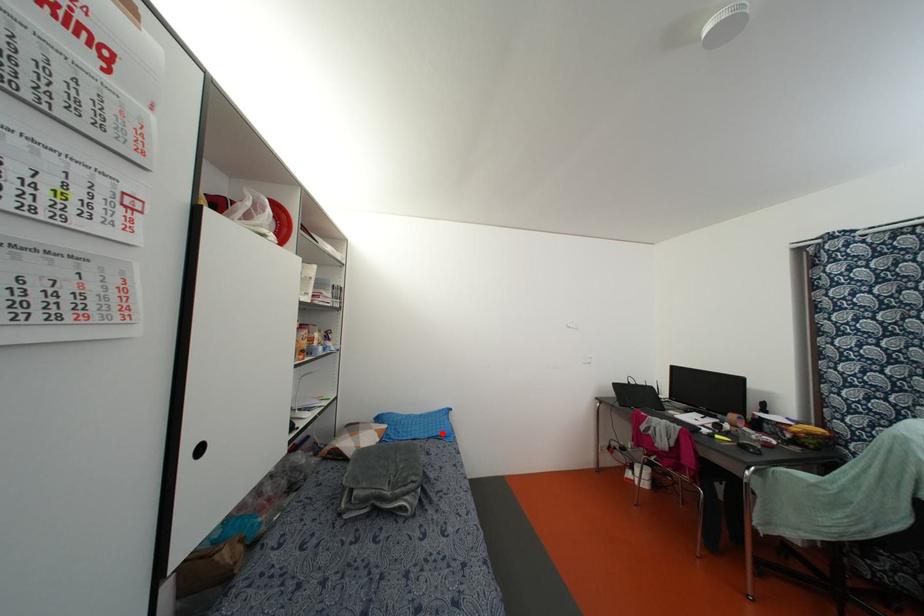
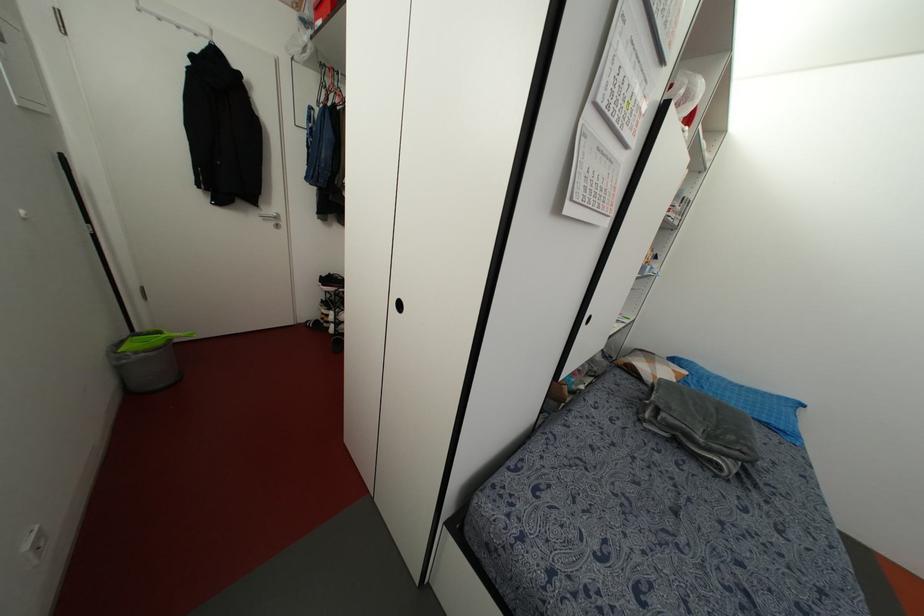
Question: A red point is marked in image1. In image2, is the corresponding 3D point closer to the camera or farther? Reply with the corresponding letter.

Choices:
 (A) The corresponding 3D point is closer.
 (B) The corresponding 3D point is farther.

Answer: (A)